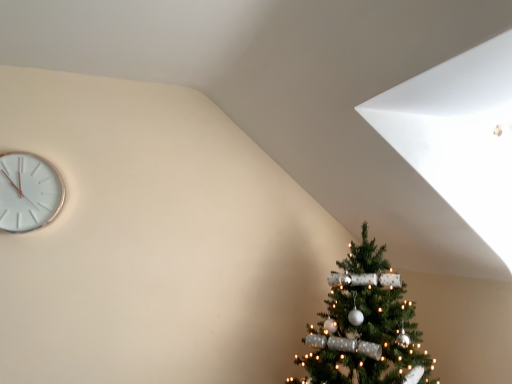
Question: Based on their sizes in the image, would you say white metallic clock at upper left is bigger or smaller than green textured christmas tree at lower right?

Choices:
 (A) big
 (B) small

Answer: (B)

Question: Is white metallic clock at upper left wider or thinner than green textured christmas tree at lower right?

Choices:
 (A) wide
 (B) thin

Answer: (B)

Question: From a real-world perspective, is white metallic clock at upper left physically located above or below green textured christmas tree at lower right?

Choices:
 (A) above
 (B) below

Answer: (A)

Question: Is green textured christmas tree at lower right inside the boundaries of white metallic clock at upper left, or outside?

Choices:
 (A) outside
 (B) inside

Answer: (A)

Question: Based on their sizes in the image, would you say green textured christmas tree at lower right is bigger or smaller than white metallic clock at upper left?

Choices:
 (A) big
 (B) small

Answer: (A)

Question: Relative to white metallic clock at upper left, is green textured christmas tree at lower right in front or behind?

Choices:
 (A) front
 (B) behind

Answer: (A)

Question: Considering the positions of green textured christmas tree at lower right and white metallic clock at upper left in the image, is green textured christmas tree at lower right taller or shorter than white metallic clock at upper left?

Choices:
 (A) short
 (B) tall

Answer: (B)